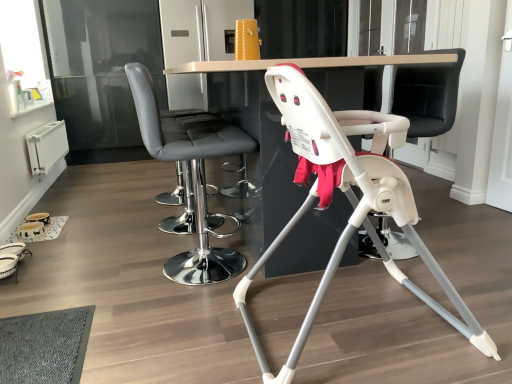
This screenshot has width=512, height=384. Find the location of `blank area to the left of white plastic highchair at center, the second chair viewed from the left`. blank area to the left of white plastic highchair at center, the second chair viewed from the left is located at coordinates (177, 330).